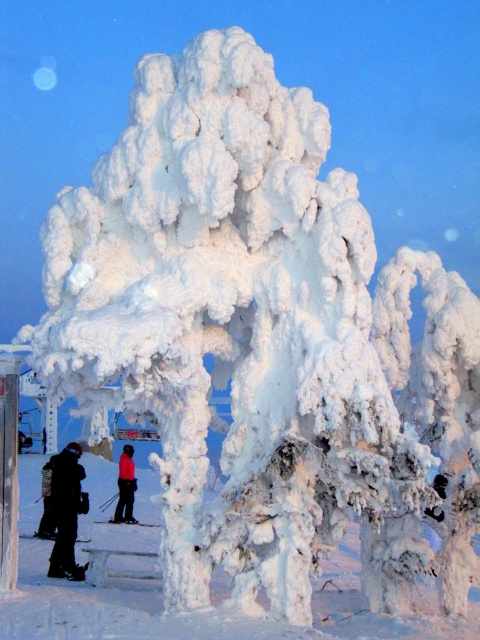
You are standing at the viewpoint of the image and want to reach the point marked as point (71, 449). If you walk straight ahead, will you reach that point before walking 20 meters?

The distance between you and point (71, 449) is 17.50 meters, so yes, you will reach the point before walking 20 meters.

You are standing at the point marked by the coordinate point at (x=204, y=611) in the image. Looking around, you notice the white frosty trees at center. Which direction should you walk to find the small wooden bench partially covered in snow in the foreground?

The small wooden bench partially covered in snow in the foreground is located in the foreground, which is typically closer to the viewer. Since you are at the point marking the white frosty trees at center, you should walk towards the bottom of the image to reach the foreground area where the bench is located.

Based on the scene description, where is the point located at coordinates (204,611)?

The point at coordinates (204,611) corresponds to the white frosty trees at center.